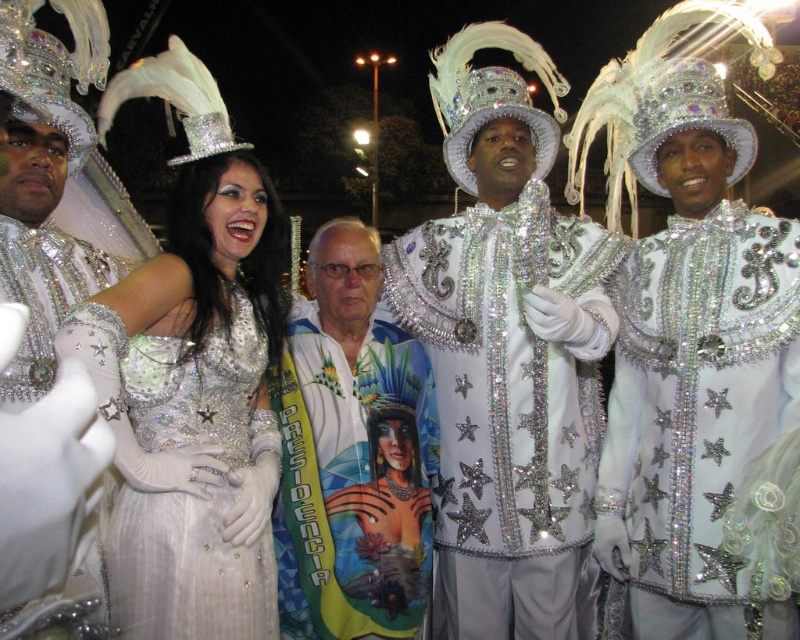
You are a photographer at the event and want to ensure the white fabric sash at center is visible in the photo. Since the glittery silver jacket at center is covering part of it, how can you adjust the composition to make the sash more visible?

The glittery silver jacket at center is located above the white fabric sash at center, so you can lower the angle of the camera slightly to shift the jacket downward and reveal more of the sash.

You are a photographer taking a picture of the sparkly silver jacket at center. Where should you point your camera to capture it?

You should point your camera at point (508, 355) to capture the sparkly silver jacket at center.